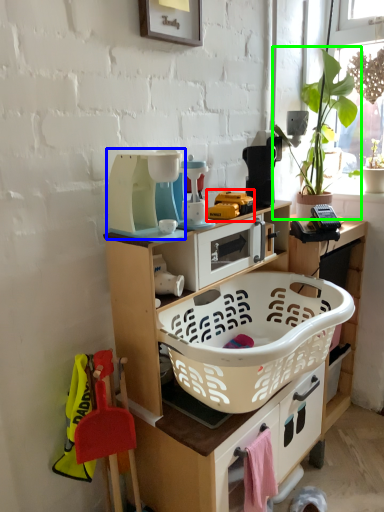
Question: Which is farther away from toy (highlighted by a red box)? appliance (highlighted by a blue box) or houseplant (highlighted by a green box)?

Choices:
 (A) appliance
 (B) houseplant

Answer: (B)